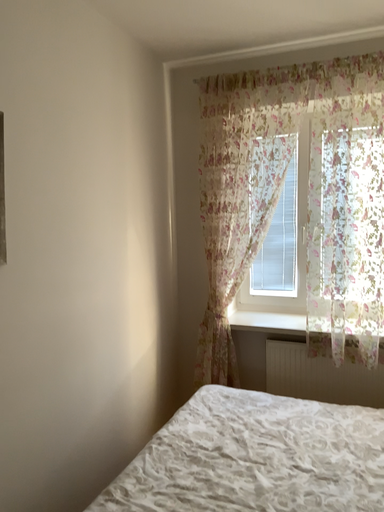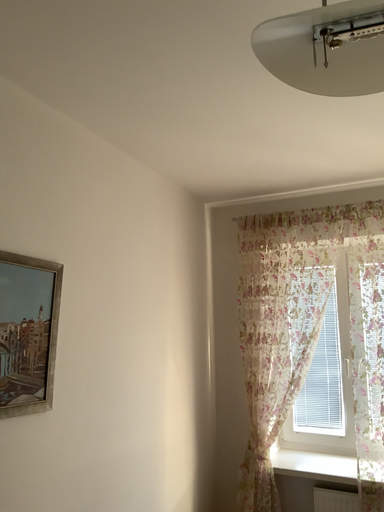
Question: Which way did the camera rotate in the video?

Choices:
 (A) rotated downward
 (B) rotated upward

Answer: (B)